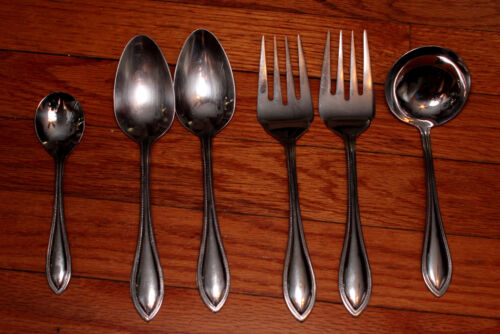
Locate an element on the screen. baby spoon is located at coordinates (73, 126).